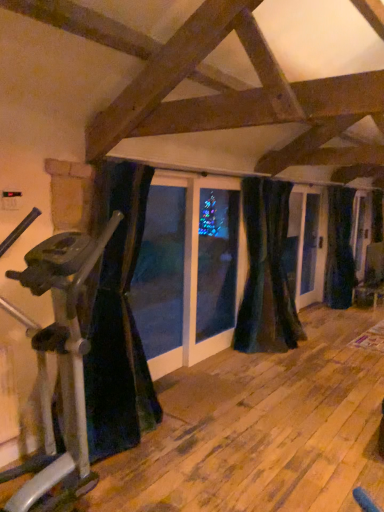
Question: Does black velvet curtain at left, arranged as the first curtain when viewed from the front, appear on the left side of dark blue velvet curtain at right, placed as the third curtain when sorted from left to right?

Choices:
 (A) yes
 (B) no

Answer: (A)

Question: Can you confirm if black velvet curtain at left, the first curtain when ordered from left to right, is shorter than dark blue velvet curtain at right, the first curtain viewed from the right?

Choices:
 (A) no
 (B) yes

Answer: (B)

Question: From a real-world perspective, is black velvet curtain at left, which appears as the 3th curtain when viewed from the back, below dark blue velvet curtain at right, the first curtain viewed from the right?

Choices:
 (A) no
 (B) yes

Answer: (A)

Question: Is black velvet curtain at left, which appears as the 3th curtain when viewed from the back, not within dark blue velvet curtain at right, which ranks as the third curtain in front-to-back order?

Choices:
 (A) yes
 (B) no

Answer: (A)

Question: From a real-world perspective, is black velvet curtain at left, arranged as the first curtain when viewed from the front, on dark blue velvet curtain at right, the first curtain positioned from the back?

Choices:
 (A) no
 (B) yes

Answer: (B)

Question: Is point (94, 201) positioned closer to the camera than point (286, 184)?

Choices:
 (A) closer
 (B) farther

Answer: (A)

Question: In terms of size, does black velvet curtain at left, arranged as the first curtain when viewed from the front, appear bigger or smaller than velvet dark blue curtain at center, which appears as the 2th curtain when viewed from the left?

Choices:
 (A) big
 (B) small

Answer: (A)

Question: From the image's perspective, relative to velvet dark blue curtain at center, which appears as the 2th curtain when viewed from the left, is black velvet curtain at left, the first curtain when ordered from left to right, above or below?

Choices:
 (A) above
 (B) below

Answer: (B)

Question: Considering their positions, is black velvet curtain at left, positioned as the third curtain in right-to-left order, located in front of or behind velvet dark blue curtain at center, which appears as the second curtain when viewed from the right?

Choices:
 (A) behind
 (B) front

Answer: (B)

Question: From a real-world perspective, relative to dark blue velvet curtain at right, the first curtain viewed from the right, is silver metallic stationary bicycle at left vertically above or below?

Choices:
 (A) above
 (B) below

Answer: (B)

Question: Considering the positions of silver metallic stationary bicycle at left and dark blue velvet curtain at right, which ranks as the third curtain in front-to-back order, in the image, is silver metallic stationary bicycle at left taller or shorter than dark blue velvet curtain at right, which ranks as the third curtain in front-to-back order,?

Choices:
 (A) tall
 (B) short

Answer: (B)

Question: Choose the correct answer: Is silver metallic stationary bicycle at left inside dark blue velvet curtain at right, placed as the third curtain when sorted from left to right, or outside it?

Choices:
 (A) outside
 (B) inside

Answer: (A)

Question: Is silver metallic stationary bicycle at left bigger or smaller than dark blue velvet curtain at right, the first curtain viewed from the right?

Choices:
 (A) small
 (B) big

Answer: (B)

Question: Considering the relative positions of velvet dark blue curtain at center, which appears as the 2th curtain when viewed from the left, and silver metallic stationary bicycle at left in the image provided, is velvet dark blue curtain at center, which appears as the 2th curtain when viewed from the left, to the left or to the right of silver metallic stationary bicycle at left?

Choices:
 (A) left
 (B) right

Answer: (B)

Question: Considering the positions of point (249, 292) and point (76, 379), is point (249, 292) closer or farther from the camera than point (76, 379)?

Choices:
 (A) closer
 (B) farther

Answer: (B)